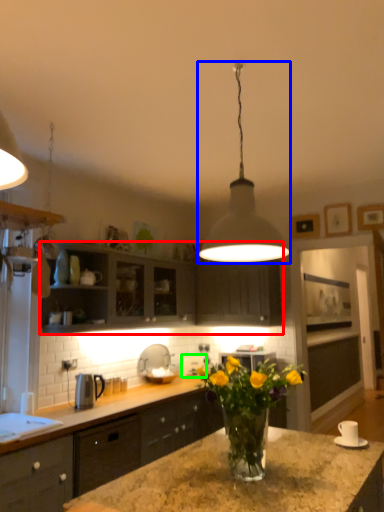
Question: Considering the real-world distances, which object is farthest from cabinetry (highlighted by a red box)? lamp (highlighted by a blue box) or appliance (highlighted by a green box)?

Choices:
 (A) lamp
 (B) appliance

Answer: (A)